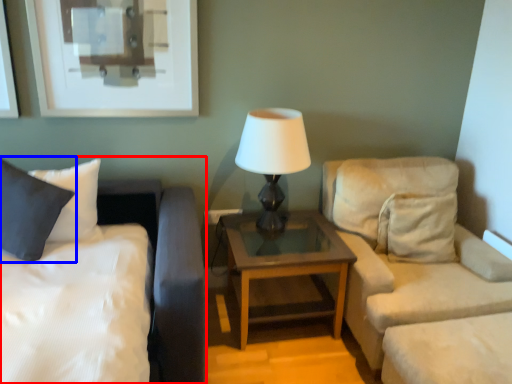
Question: Which object appears closest to the camera in this image, bed (highlighted by a red box) or pillow (highlighted by a blue box)?

Choices:
 (A) bed
 (B) pillow

Answer: (A)